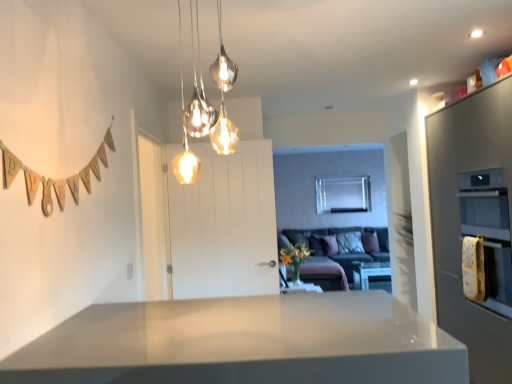
Describe the element at coordinates (225, 224) in the screenshot. Image resolution: width=512 pixels, height=384 pixels. I see `white wooden door at center` at that location.

You are a GUI agent. You are given a task and a screenshot of the screen. Output one action in this format:
    pyautogui.click(x=<x>, y=<y>)
    Task: Click on the white glossy countertop at center
    The height and width of the screenshot is (384, 512).
    Given the screenshot: What is the action you would take?
    pyautogui.click(x=244, y=343)

Where is `velvet grey couch at center`? velvet grey couch at center is located at coordinates (327, 257).

What is the approximate height of velvet grey couch at center?

velvet grey couch at center is 36.10 inches tall.

This screenshot has height=384, width=512. I want to click on satin grey oven at right, so click(474, 223).

Where is `white glossy table at center`? Image resolution: width=512 pixels, height=384 pixels. white glossy table at center is located at coordinates (368, 272).

In order to face white glossy table at center, should I rotate leftwards or rightwards?

You should look right and rotate roughly 15.949 degrees.

This screenshot has width=512, height=384. What do you see at coordinates (486, 239) in the screenshot? I see `gold textured oven at right` at bounding box center [486, 239].

I want to click on white wooden door at center, so click(225, 224).

Could you tell me if metallic glass pendant lights at upper center is facing white glossy table at center?

No, metallic glass pendant lights at upper center is not facing towards white glossy table at center.

Is metallic glass pendant lights at upper center wider than white glossy table at center?

In fact, metallic glass pendant lights at upper center might be narrower than white glossy table at center.

Which of these two, metallic glass pendant lights at upper center or white glossy table at center, stands taller?

With more height is metallic glass pendant lights at upper center.

Which is more to the left, velvet grey couch at center or white glossy table at center?

velvet grey couch at center is more to the left.

How different are the orientations of velvet grey couch at center and white glossy table at center in degrees?

1.2 degrees.

Between velvet grey couch at center and white glossy table at center, which one has smaller width?

Thinner between the two is white glossy table at center.

Does point (316, 249) lie in front of point (353, 261)?

That is False.

Considering the relative sizes of gold textured oven at right and velvet grey couch at center in the image provided, is gold textured oven at right smaller than velvet grey couch at center?

Yes, gold textured oven at right is smaller than velvet grey couch at center.

Does gold textured oven at right have a greater height compared to velvet grey couch at center?

No, gold textured oven at right is not taller than velvet grey couch at center.

Is gold textured oven at right not near velvet grey couch at center?

Absolutely, gold textured oven at right is distant from velvet grey couch at center.

Which of these two, white wooden door at center or white glossy table at center, is bigger?

Bigger between the two is white wooden door at center.

In terms of width, does white wooden door at center look wider or thinner when compared to white glossy table at center?

In the image, white wooden door at center appears to be more narrow than white glossy table at center.

Does white wooden door at center have a greater height compared to white glossy table at center?

Indeed, white wooden door at center has a greater height compared to white glossy table at center.

Relative to satin grey oven at right, is white glossy table at center in front or behind?

white glossy table at center is behind satin grey oven at right.

From the picture: Does white glossy table at center contain satin grey oven at right?

Definitely not — satin grey oven at right is not inside white glossy table at center.

Consider the image. Can you confirm if white glossy table at center is shorter than satin grey oven at right?

Correct, white glossy table at center is not as tall as satin grey oven at right.

How many degrees apart are the facing directions of gold textured oven at right and white glossy table at center?

88.5 degrees separate the facing orientations of gold textured oven at right and white glossy table at center.

Is gold textured oven at right located outside white glossy table at center?

Yes, gold textured oven at right is not within white glossy table at center.

Can you confirm if gold textured oven at right is shorter than white glossy table at center?

No, gold textured oven at right is not shorter than white glossy table at center.

From a real-world perspective, is gold textured oven at right on top of white glossy table at center?

Yes, from a real-world perspective, gold textured oven at right is on top of white glossy table at center.

Locate an element on the screen. This screenshot has height=384, width=512. cabinetry located above the velvet grey couch at center (from a real-world perspective) is located at coordinates (474, 223).

Considering the points (325, 273) and (505, 238), which point is in front, point (325, 273) or point (505, 238)?

Positioned in front is point (505, 238).

Is the depth of velvet grey couch at center greater than that of satin grey oven at right?

Yes, it is behind satin grey oven at right.

Could you tell me if velvet grey couch at center is turned towards satin grey oven at right?

Yes, velvet grey couch at center is aimed at satin grey oven at right.

You are a GUI agent. You are given a task and a screenshot of the screen. Output one action in this format:
    pyautogui.click(x=<x>, y=<y>)
    Task: Click on the lamp that is above the white glossy table at center (from a real-world perspective)
    
    Given the screenshot: What is the action you would take?
    pyautogui.click(x=206, y=111)

In the image, there is a white glossy table at center. Identify the location of couch above it (from the image's perspective). This screenshot has width=512, height=384. (327, 257).

Looking at the image, which one is located further to satin grey oven at right, white wooden door at center or white glossy table at center?

Based on the image, white glossy table at center appears to be further to satin grey oven at right.

Considering their positions, is gold textured oven at right positioned closer to white wooden door at center than velvet grey couch at center?

gold textured oven at right is positioned closer to the anchor white wooden door at center.

In the scene shown: Estimate the real-world distances between objects in this image. Which object is closer to white wooden door at center, gold textured oven at right or satin grey oven at right?

satin grey oven at right is closer to white wooden door at center.

Based on their spatial positions, is gold textured oven at right or white glossy table at center further from metallic glass pendant lights at upper center?

white glossy table at center.

Looking at the image, which one is located further to white glossy countertop at center, white wooden door at center or satin grey oven at right?

satin grey oven at right is positioned further to the anchor white glossy countertop at center.

Based on their spatial positions, is gold textured oven at right or velvet grey couch at center further from satin grey oven at right?

The object further to satin grey oven at right is velvet grey couch at center.

Considering their positions, is white glossy countertop at center positioned further to metallic glass pendant lights at upper center than white glossy table at center?

Based on the image, white glossy table at center appears to be further to metallic glass pendant lights at upper center.

From the picture: When comparing their distances from gold textured oven at right, does velvet grey couch at center or satin grey oven at right seem further?

The object further to gold textured oven at right is velvet grey couch at center.

This screenshot has height=384, width=512. Identify the location of cabinetry positioned between white glossy countertop at center and velvet grey couch at center from near to far. (x=474, y=223).

Image resolution: width=512 pixels, height=384 pixels. I want to click on oven positioned between metallic glass pendant lights at upper center and velvet grey couch at center from near to far, so click(x=486, y=239).

Where is `couch between gold textured oven at right and white glossy table at center along the z-axis`? couch between gold textured oven at right and white glossy table at center along the z-axis is located at coordinates (327, 257).

The height and width of the screenshot is (384, 512). Identify the location of door between satin grey oven at right and white glossy table at center from front to back. (225, 224).